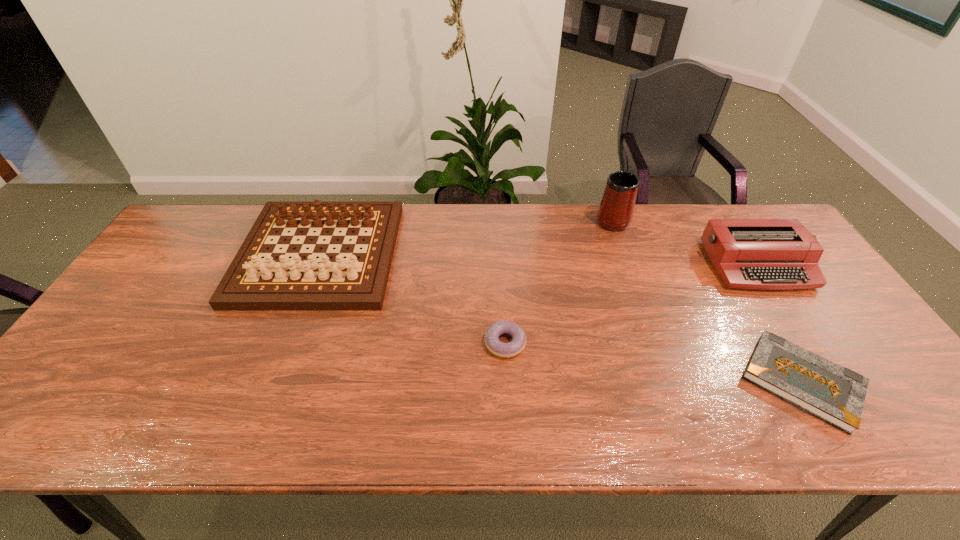
The image size is (960, 540). In order to click on vacant area at the left edge in this screenshot , I will do `click(149, 356)`.

The image size is (960, 540). What are the coordinates of `vacant region at the right edge of the desktop` in the screenshot? It's located at (899, 394).

You are a GUI agent. You are given a task and a screenshot of the screen. Output one action in this format:
    pyautogui.click(x=<x>, y=<y>)
    Task: Click on the vacant space at the near left corner of the desktop
    The width and height of the screenshot is (960, 540).
    Given the screenshot: What is the action you would take?
    pyautogui.click(x=94, y=414)

I want to click on vacant space in between the second object from left to right and the third object from left to right, so click(x=559, y=281).

Image resolution: width=960 pixels, height=540 pixels. Identify the location of free spot between the third object from left to right and the leftmost object. (466, 237).

The image size is (960, 540). Find the location of `vacant space that's between the gameboard and the notebook`. vacant space that's between the gameboard and the notebook is located at coordinates (561, 318).

The width and height of the screenshot is (960, 540). I want to click on vacant area between the notebook and the leftmost object, so click(561, 318).

I want to click on vacant region between the gameboard and the notebook, so click(x=561, y=318).

Find the location of a particular element. This screenshot has height=540, width=960. free spot between the typewriter and the mug is located at coordinates (684, 242).

Where is `free point between the fourth object from right to left and the gameboard`? This screenshot has width=960, height=540. free point between the fourth object from right to left and the gameboard is located at coordinates (412, 299).